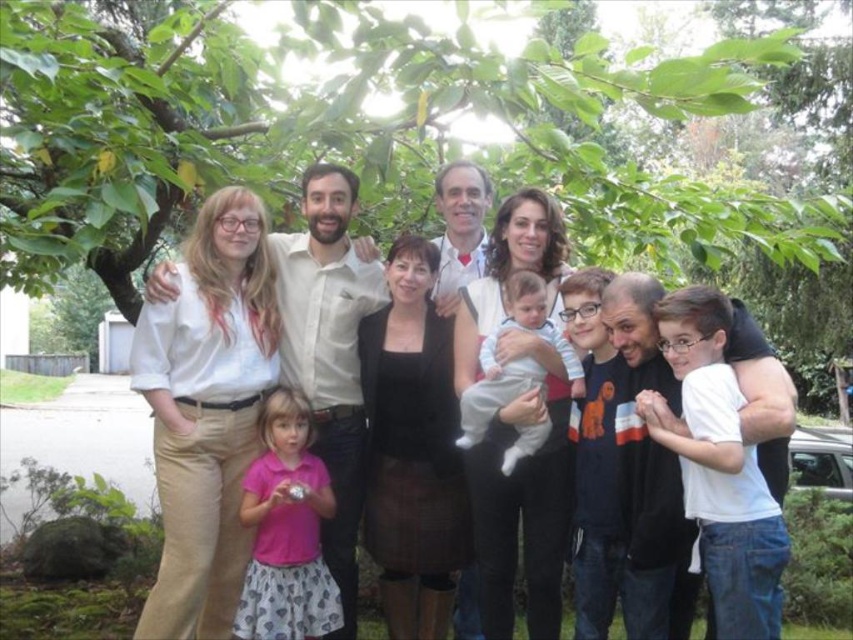
You are organizing a photo shoot and need to arrange the matte white shirt at center and the light blue cotton onesie at center based on their sizes. Which clothing item should you place first if you want to start with the bigger one?

The matte white shirt at center has a larger size compared to the light blue cotton onesie at center, so you should place the matte white shirt at center first.

You are taking a photo of the group under the tree and want to focus on two specific points in the image. The first point is at coordinates point (335, 332), and the second is at point (244, 509). Which point is closer to the camera?

Point (335, 332) is further to the camera than point (244, 509). Therefore, point (244, 509) is closer to the camera.

You are taking a photo of the group under the tree and want to adjust your position so that both the point at (335, 573) and the point at (521, 308) are in focus. Which point should you focus on first to ensure both are sharp?

You should focus on the point at (521, 308) first because it is farther away from the viewer compared to the point at (335, 573). By focusing on the farther point, the closer point will also be within the depth of field.